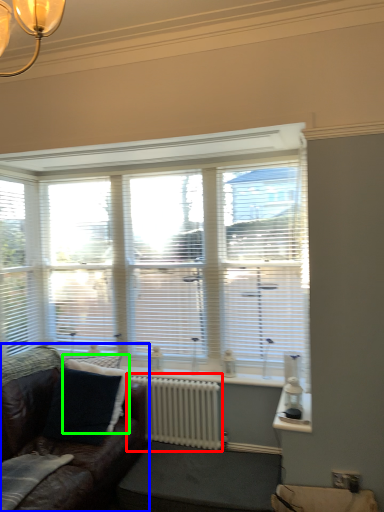
Question: Considering the real-world distances, which object is farthest from radiator (highlighted by a red box)? studio couch (highlighted by a blue box) or pillow (highlighted by a green box)?

Choices:
 (A) studio couch
 (B) pillow

Answer: (A)